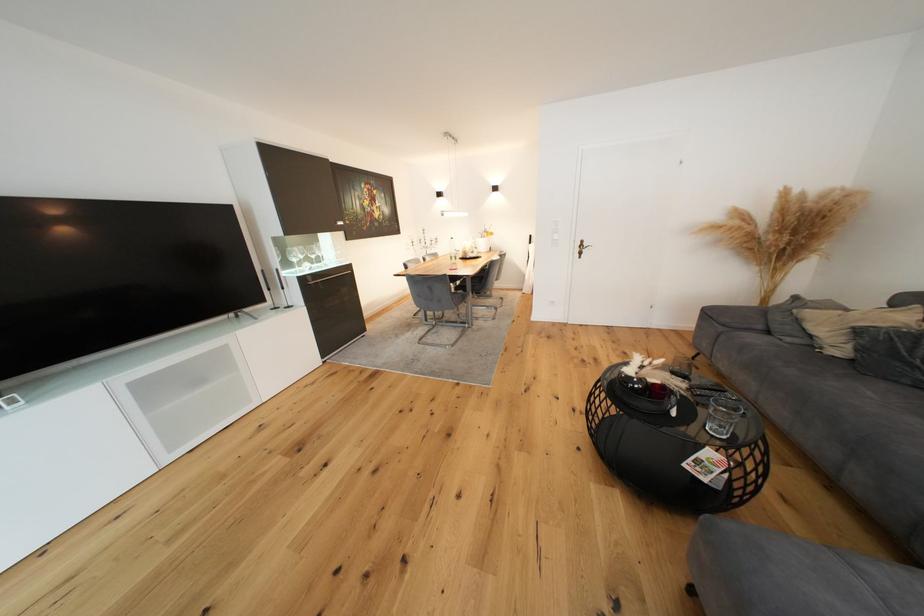
Where is `printed magazine`? Image resolution: width=924 pixels, height=616 pixels. printed magazine is located at coordinates (708, 467).